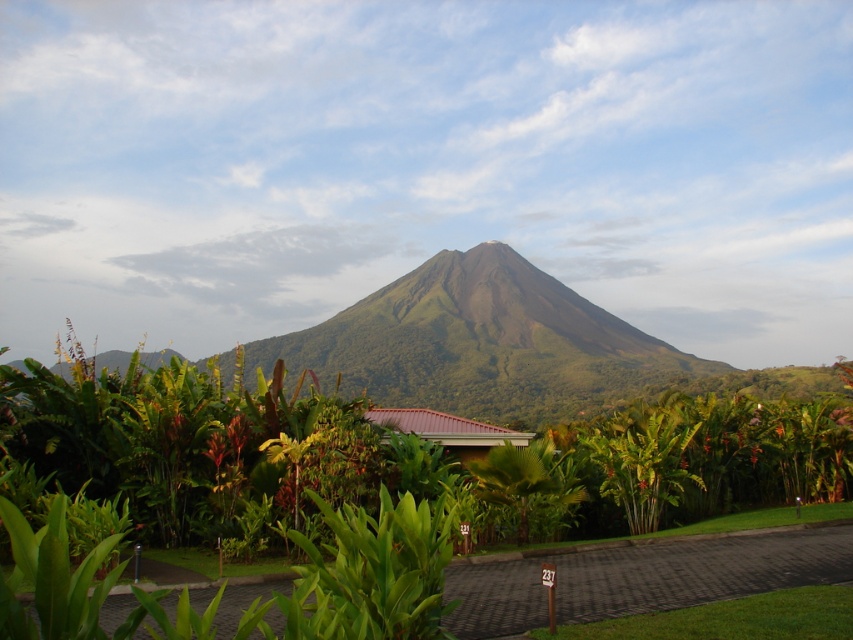
Which of these two, green leafy tree at center or green leafy palm tree at center, stands taller?

green leafy tree at center

Where is `green leafy tree at center`? The height and width of the screenshot is (640, 853). green leafy tree at center is located at coordinates (398, 454).